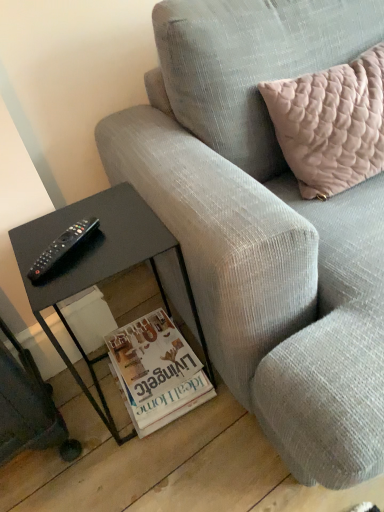
At what (x,y) coordinates should I click in order to perform the action: click on vacant region above black glass table at lower left (from a real-world perspective). Please return your answer as a coordinate pair (x, y). Image resolution: width=384 pixels, height=512 pixels. Looking at the image, I should click on (84, 248).